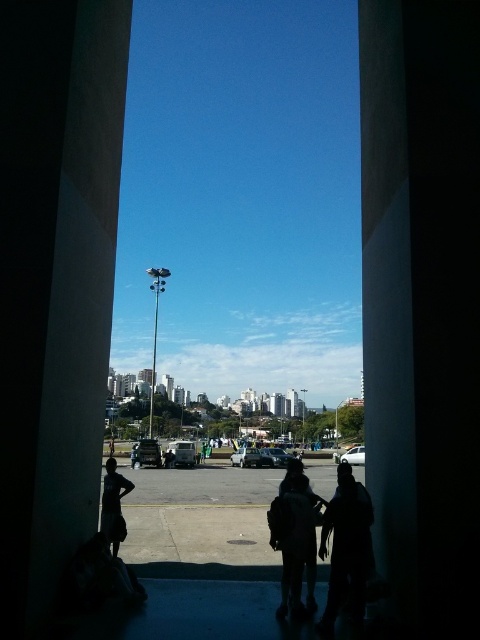
You are organizing a charity event and need to display two jackets, the dark fabric jacket at center and the dark gray hoodie at center, on a narrow mannequin stand. Which jacket would you choose to fit better on the stand if the stand can only accommodate items narrower than the other?

The dark fabric jacket at center has a smaller width than the dark gray hoodie at center, so it would fit better on the narrow mannequin stand.